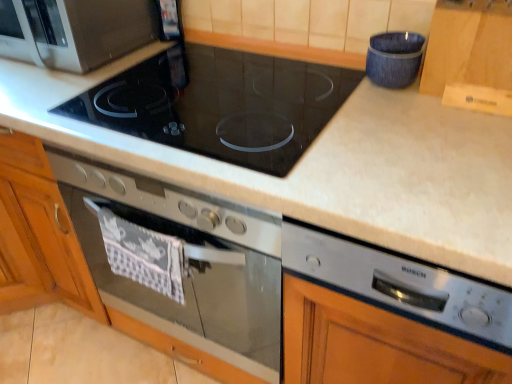
Identify the location of free space in front of blue textured fabric at upper right, positioned as the second appliance in bottom-to-top order. The width and height of the screenshot is (512, 384). (407, 119).